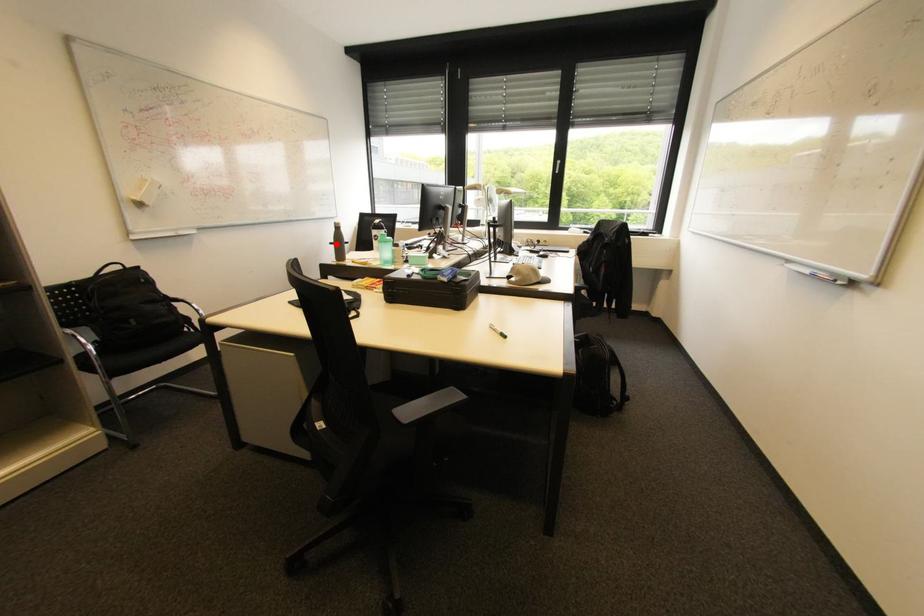
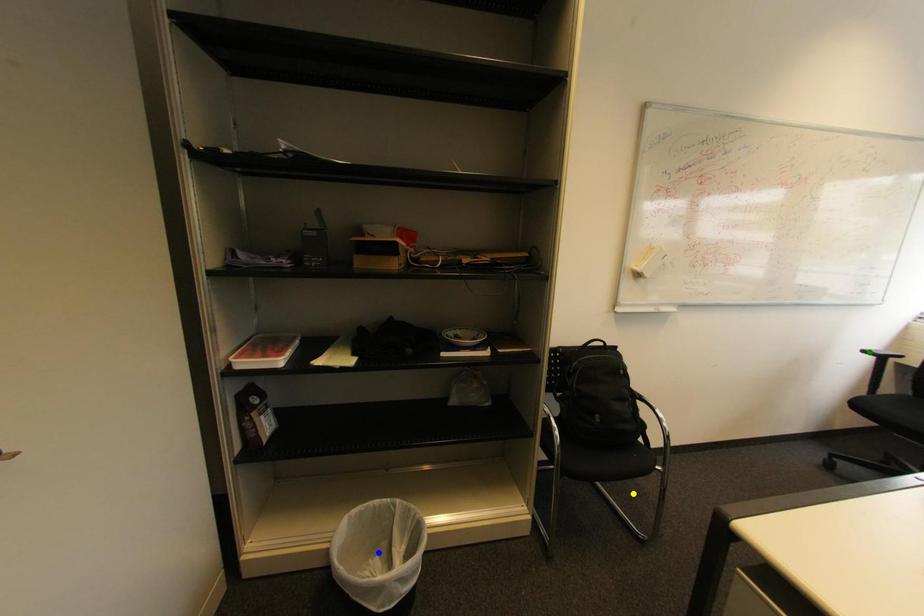
Question: I am providing you with two images of the same scene from different viewpoints. A red point is marked on the first image. You are given multiple points on the second image. Which point in image 2 is actually the same real-world point as the red point in image 1?

Choices:
 (A) blue point
 (B) yellow point
 (C) green point

Answer: (C)